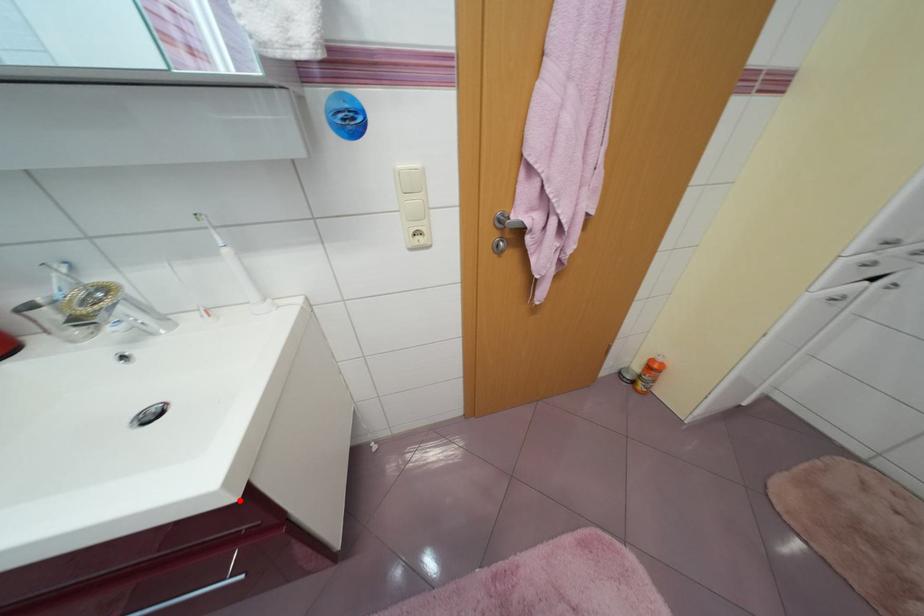
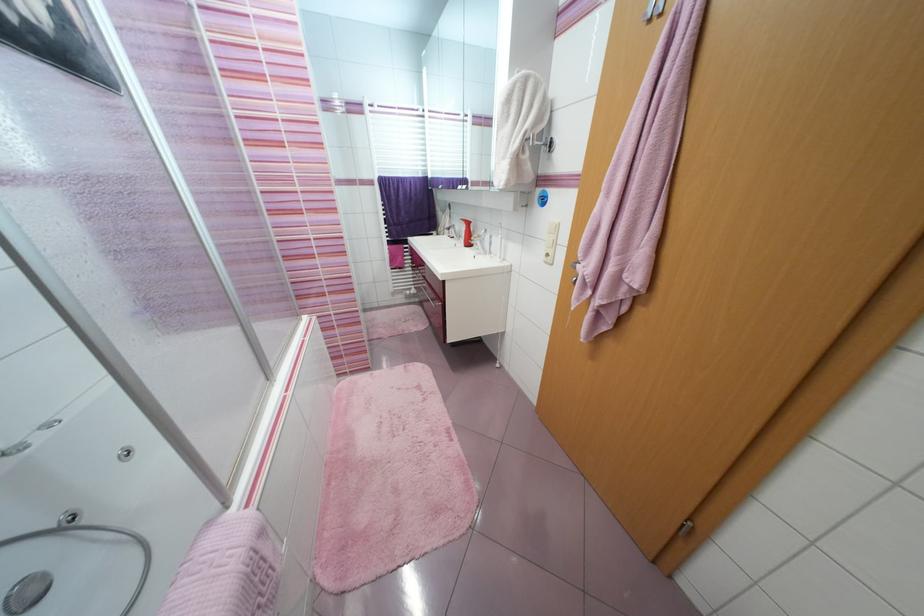
The point at the highlighted location is marked in the first image. Where is the corresponding point in the second image?

(445, 281)